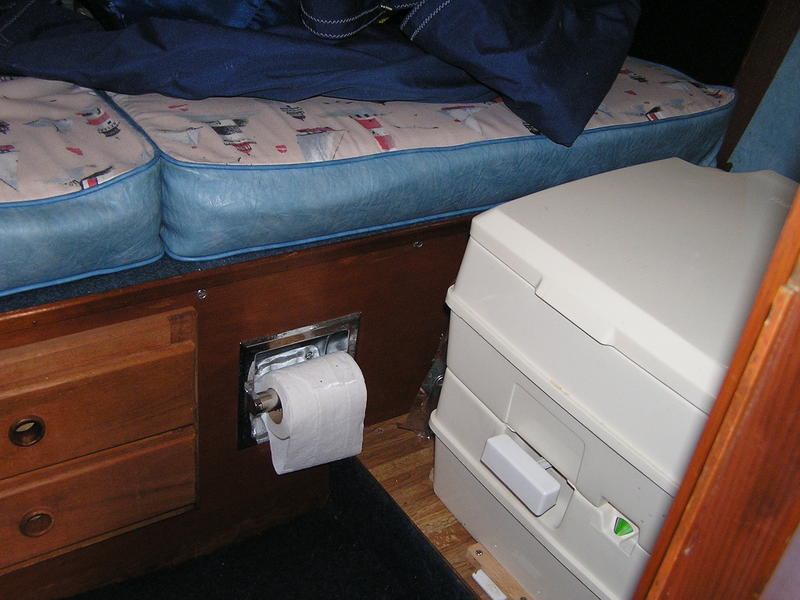
This screenshot has width=800, height=600. In order to click on mattress in this screenshot , I will do `click(302, 196)`, `click(26, 212)`.